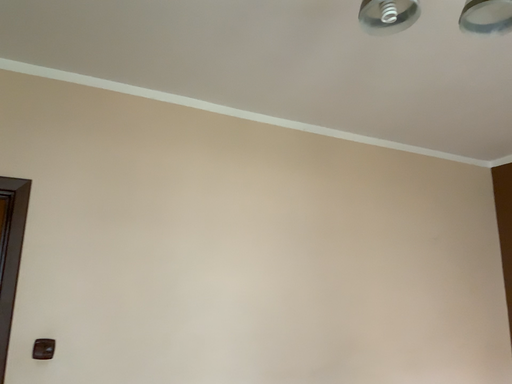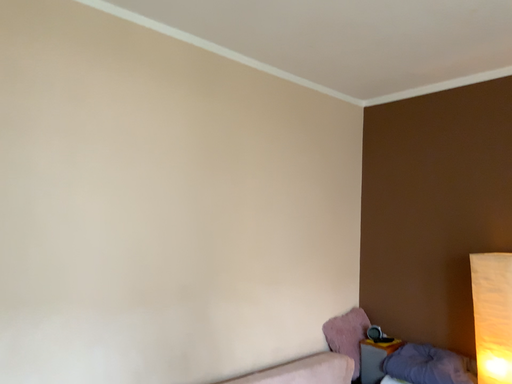
Question: Which way did the camera rotate in the video?

Choices:
 (A) rotated downward
 (B) rotated upward

Answer: (A)